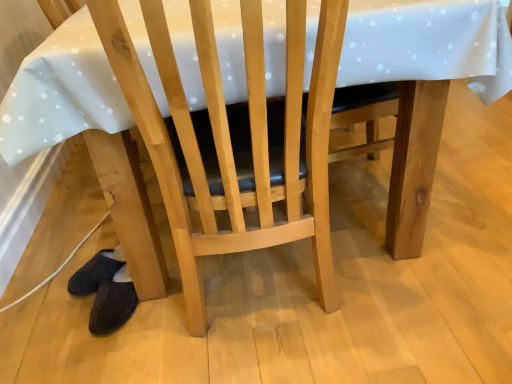
Find the location of a particular element. vacant area situated to the left side of dark blue fuzzy slippers at lower left is located at coordinates (59, 321).